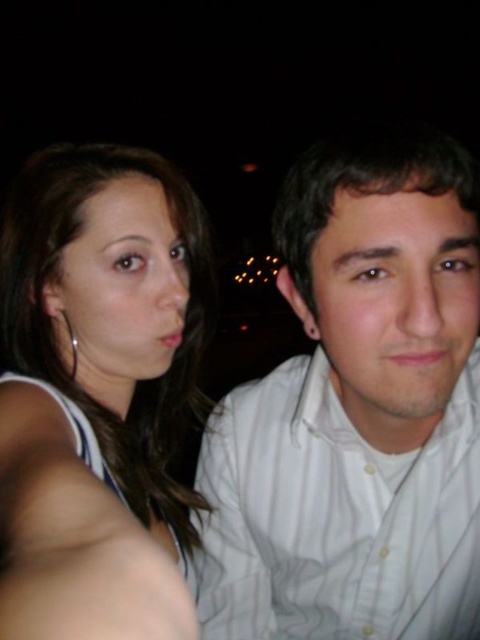
From the picture: Who is higher up, matte white tank top at left or white smooth skin at center?

Positioned higher is white smooth skin at center.

Who is more distant from viewer, (129, 596) or (84, 490)?

Positioned behind is point (84, 490).

At what (x,y) coordinates should I click in order to perform the action: click on matte white tank top at left. Please return your answer as a coordinate pair (x, y). Looking at the image, I should click on coord(97,394).

Looking at this image, does white striped shirt at center have a smaller size compared to white smooth skin at center?

No, white striped shirt at center is not smaller than white smooth skin at center.

The height and width of the screenshot is (640, 480). Find the location of `white striped shirt at center`. white striped shirt at center is located at coordinates (358, 412).

This screenshot has height=640, width=480. In order to click on white striped shirt at center in this screenshot , I will do `click(358, 412)`.

Where is `white striped shirt at center`? Image resolution: width=480 pixels, height=640 pixels. white striped shirt at center is located at coordinates (358, 412).

Does white striped shirt at center appear over matte white tank top at left?

Yes, white striped shirt at center is above matte white tank top at left.

Between white striped shirt at center and matte white tank top at left, which one appears on the right side from the viewer's perspective?

white striped shirt at center

Which is in front, point (253, 496) or point (80, 602)?

Point (80, 602) is more forward.

The image size is (480, 640). In order to click on white striped shirt at center in this screenshot , I will do [358, 412].